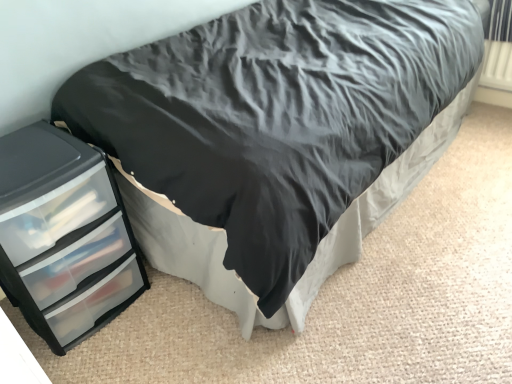
Question: Should I look upward or downward to see transparent plastic chest of drawers at left?

Choices:
 (A) up
 (B) down

Answer: (B)